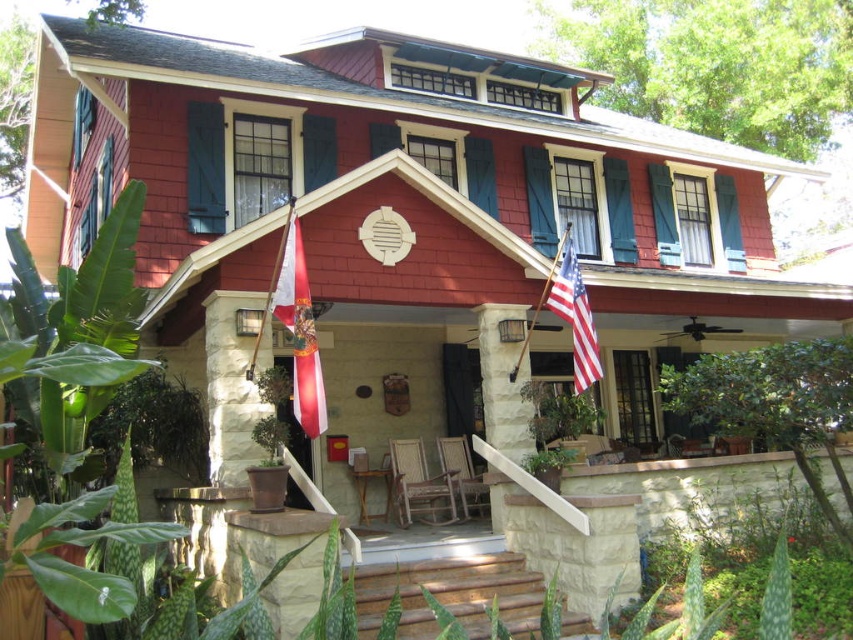
You are standing in front of the house and want to know how far the point at coordinates point (492, 314) is from you. Can you determine the distance?

The point (492, 314) is 9.43 meters from the camera, so the distance is 9.43 meters.

You are standing on the porch of the house and want to place a new flower pot between the white stucco flagpole at lower left and the american flag at center. Which object should the flower pot be closer to if you want it to be centered between them?

The flower pot should be closer to the white stucco flagpole at lower left because it is positioned on the left side of the american flag at center, so placing it midway would require it to be closer to the flagpole to balance the distance.